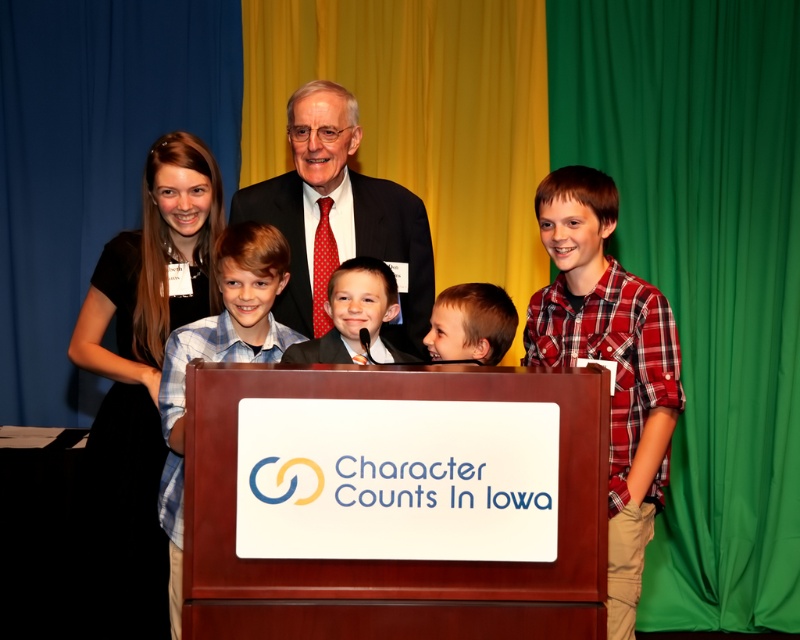
Does dark suit at center come in front of blue plaid shirt at center?

No, dark suit at center is further to the viewer.

Is dark suit at center taller than blue plaid shirt at center?

Incorrect, dark suit at center's height is not larger of blue plaid shirt at center's.

Does point (310, 332) come in front of point (256, 237)?

No.

This screenshot has height=640, width=800. Identify the location of dark suit at center. (338, 214).

Which is more to the left, matte black suit at center or blue plaid shirt at center?

blue plaid shirt at center is more to the left.

Is point (594, 177) less distant than point (160, 524)?

That is True.

Find the location of `matte black suit at center`. matte black suit at center is located at coordinates (578, 225).

Which of these two, blue plaid shirt at center or smooth black suit at center, stands taller?

blue plaid shirt at center

The image size is (800, 640). What are the coordinates of `blue plaid shirt at center` in the screenshot? It's located at (220, 358).

You are a GUI agent. You are given a task and a screenshot of the screen. Output one action in this format:
    pyautogui.click(x=<x>, y=<y>)
    Task: Click on the blue plaid shirt at center
    
    Given the screenshot: What is the action you would take?
    pyautogui.click(x=220, y=358)